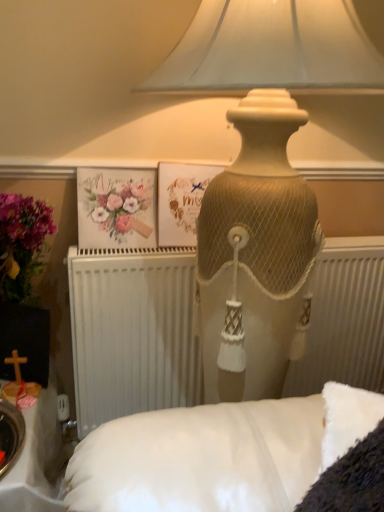
Question: In terms of width, does white textured radiator at center look wider or thinner when compared to matte beige lamp at upper center?

Choices:
 (A) wide
 (B) thin

Answer: (B)

Question: Relative to matte beige lamp at upper center, is white textured radiator at center in front or behind?

Choices:
 (A) front
 (B) behind

Answer: (B)

Question: Estimate the real-world distances between objects in this image. Which object is closer to the white textured radiator at center?

Choices:
 (A) matte paper postcard at center
 (B) matte beige lamp at upper center
 (C) watercolor paper flowers at upper left

Answer: (A)

Question: Estimate the real-world distances between objects in this image. Which object is farther from the matte paper postcard at center?

Choices:
 (A) white textured radiator at center
 (B) watercolor paper flowers at upper left
 (C) matte beige lamp at upper center

Answer: (C)